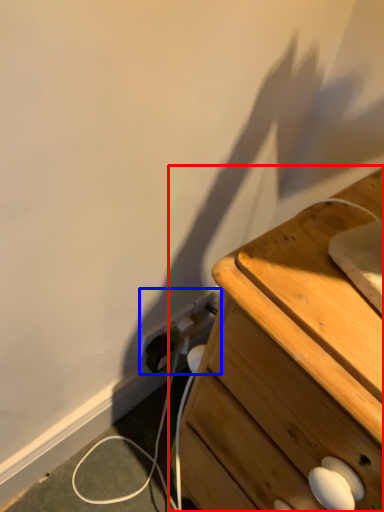
Question: Which object appears closest to the camera in this image, chest of drawers (highlighted by a red box) or electric outlet (highlighted by a blue box)?

Choices:
 (A) chest of drawers
 (B) electric outlet

Answer: (A)